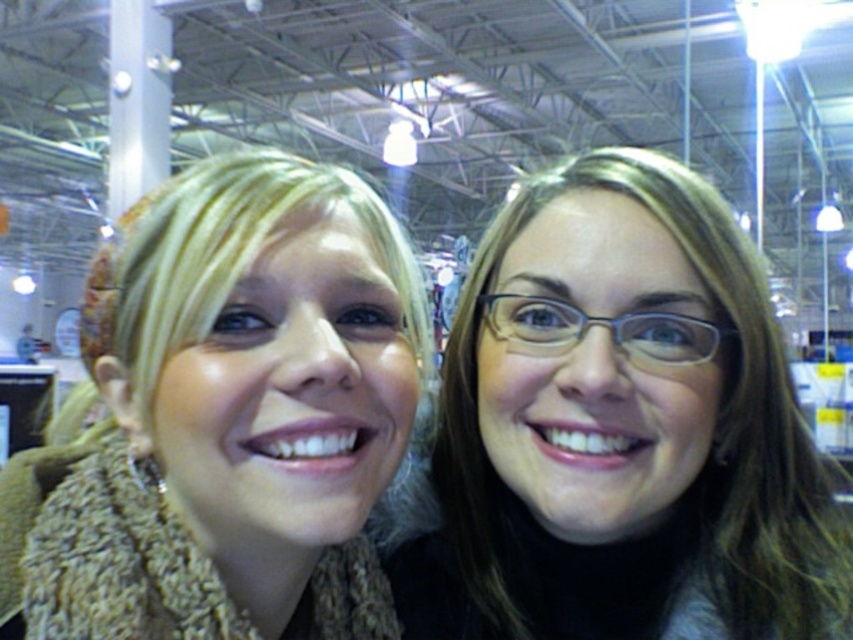
Is matte black glasses at upper right wider than knitted beige scarf at left?

In fact, matte black glasses at upper right might be narrower than knitted beige scarf at left.

Who is positioned more to the right, matte black glasses at upper right or knitted beige scarf at left?

matte black glasses at upper right

Is point (672, 209) farther from viewer compared to point (215, 602)?

That is True.

Find the location of a particular element. The width and height of the screenshot is (853, 640). matte black glasses at upper right is located at coordinates [622, 429].